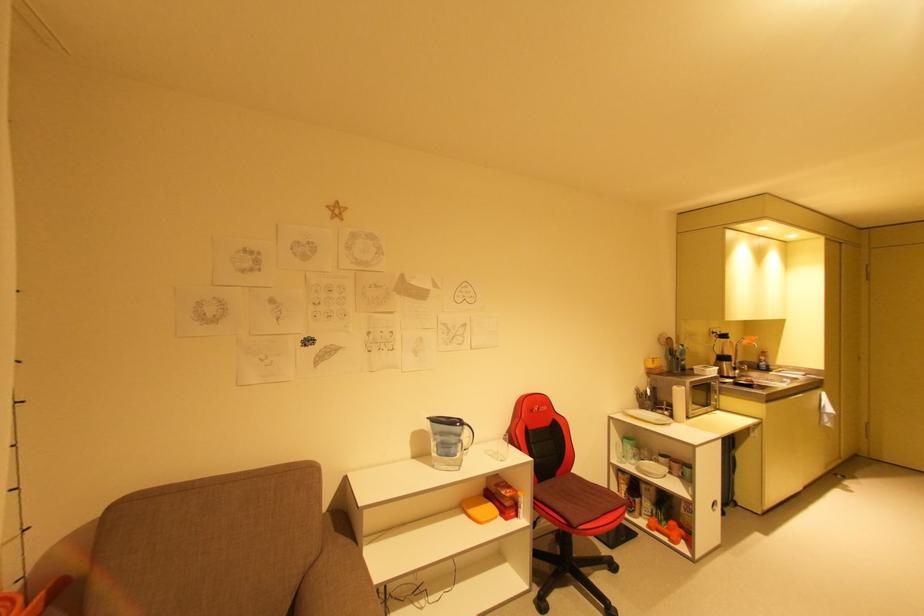
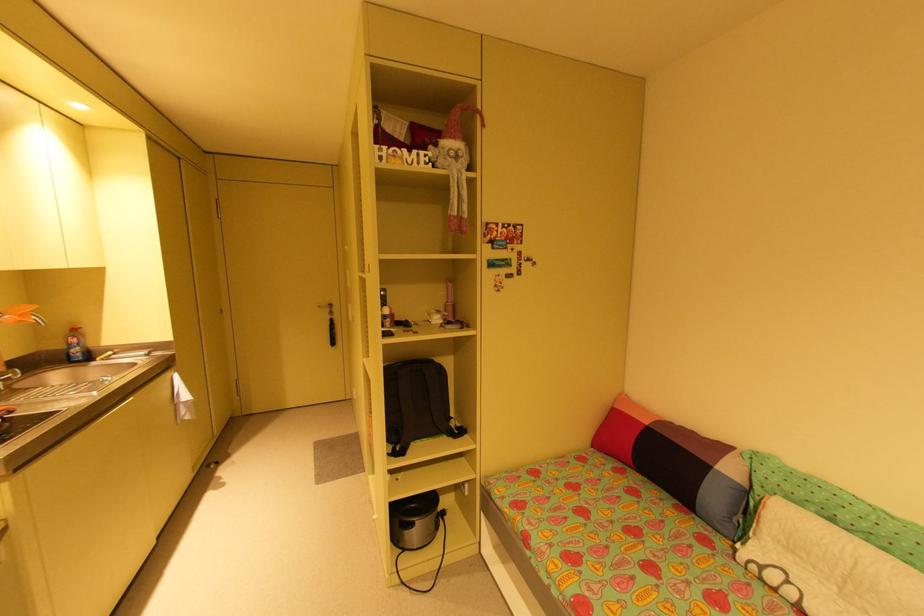
In the second image, find the point that corresponds to point 768,353 in the first image.

(79, 331)